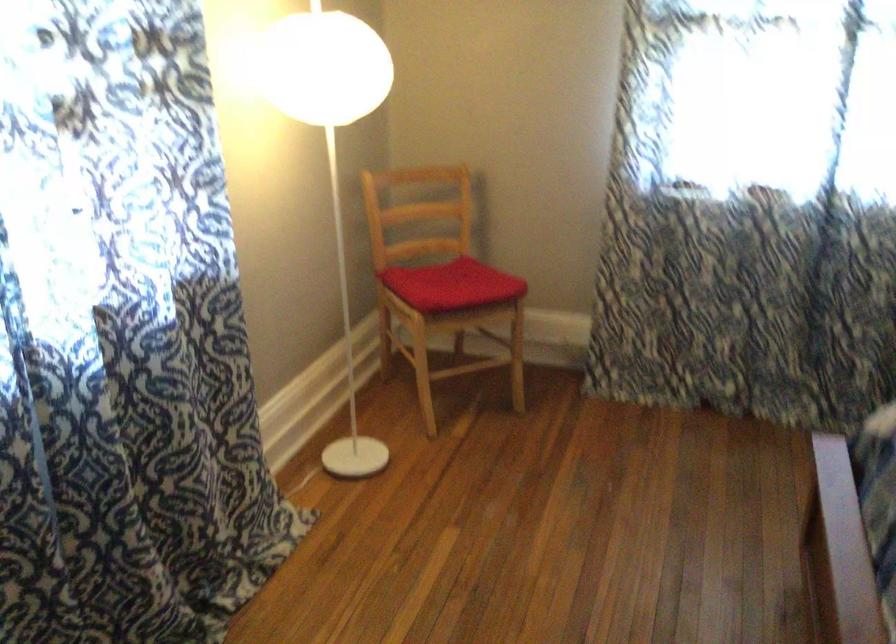
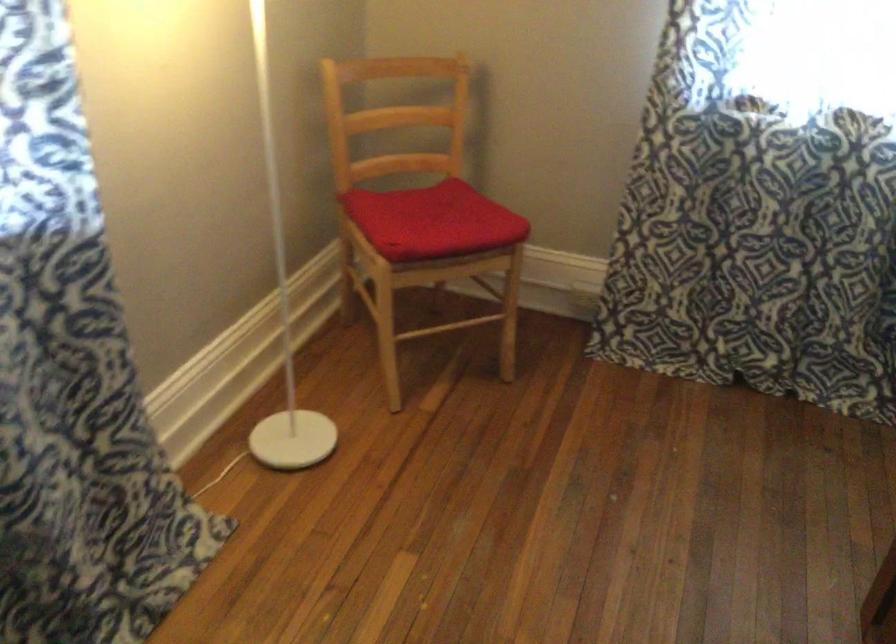
Question: In a continuous first-person perspective shot, in which direction is the camera moving?

Choices:
 (A) Left
 (B) Right
 (C) Forward
 (D) Backward

Answer: (C)